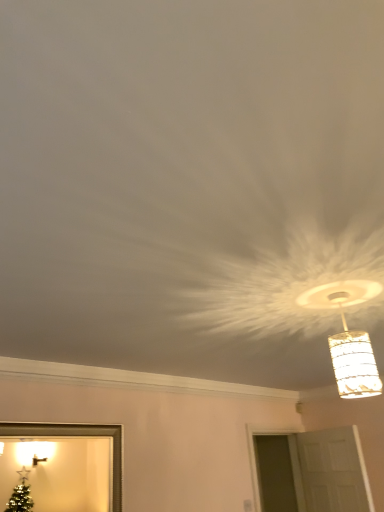
Question: Considering their positions, is translucent glass pendant light at upper right located in front of or behind white matte door at lower right?

Choices:
 (A) behind
 (B) front

Answer: (B)

Question: In terms of size, does translucent glass pendant light at upper right appear bigger or smaller than white matte door at lower right?

Choices:
 (A) big
 (B) small

Answer: (B)

Question: Which of these objects is positioned farthest from the translucent glass pendant light at upper right?

Choices:
 (A) white matte door at lower right
 (B) gold metallic picture frame at lower left

Answer: (A)

Question: Which of these objects is positioned closest to the white matte door at lower right?

Choices:
 (A) translucent glass pendant light at upper right
 (B) gold metallic picture frame at lower left

Answer: (B)